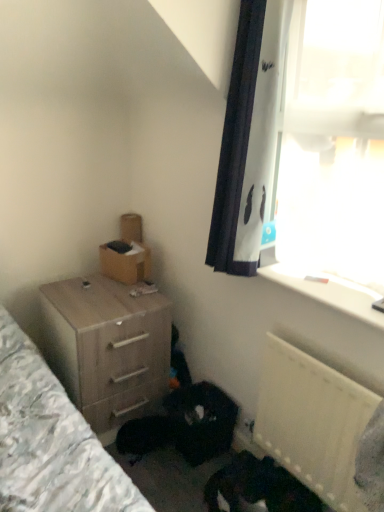
Question: Can you confirm if dark fur cat at lower center is thinner than white plastic window sill at upper right?

Choices:
 (A) no
 (B) yes

Answer: (A)

Question: From the image's perspective, is dark fur cat at lower center located beneath white plastic window sill at upper right?

Choices:
 (A) yes
 (B) no

Answer: (A)

Question: Is the position of dark fur cat at lower center less distant than that of white plastic window sill at upper right?

Choices:
 (A) no
 (B) yes

Answer: (B)

Question: Is dark fur cat at lower center wider than white plastic window sill at upper right?

Choices:
 (A) yes
 (B) no

Answer: (A)

Question: Would you consider dark fur cat at lower center to be distant from white plastic window sill at upper right?

Choices:
 (A) no
 (B) yes

Answer: (A)

Question: From a real-world perspective, is dark fur cat at lower center located higher than white plastic window sill at upper right?

Choices:
 (A) no
 (B) yes

Answer: (A)

Question: Is white plastic radiator at lower right taller than white plastic window sill at upper right?

Choices:
 (A) no
 (B) yes

Answer: (B)

Question: Is white plastic radiator at lower right to the right of white plastic window sill at upper right from the viewer's perspective?

Choices:
 (A) no
 (B) yes

Answer: (A)

Question: Does white plastic radiator at lower right have a smaller size compared to white plastic window sill at upper right?

Choices:
 (A) no
 (B) yes

Answer: (A)

Question: Is white plastic radiator at lower right touching white plastic window sill at upper right?

Choices:
 (A) yes
 (B) no

Answer: (B)

Question: Is white plastic radiator at lower right turned away from white plastic window sill at upper right?

Choices:
 (A) no
 (B) yes

Answer: (A)

Question: Would you consider white plastic radiator at lower right to be distant from white plastic window sill at upper right?

Choices:
 (A) no
 (B) yes

Answer: (A)

Question: Can you confirm if white plastic radiator at lower right is thinner than brown cardboard box at upper left?

Choices:
 (A) yes
 (B) no

Answer: (A)